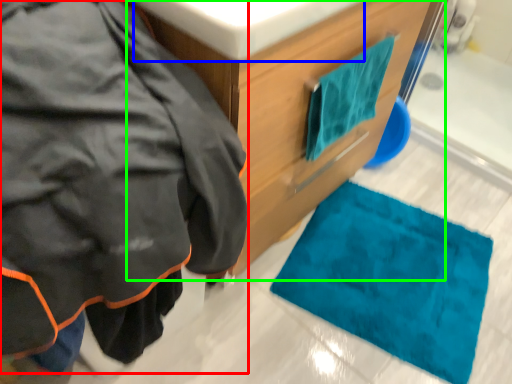
Question: Which object is the closest to the jacket (highlighted by a red box)? Choose among these: sink (highlighted by a blue box) or bathroom cabinet (highlighted by a green box).

Choices:
 (A) sink
 (B) bathroom cabinet

Answer: (A)